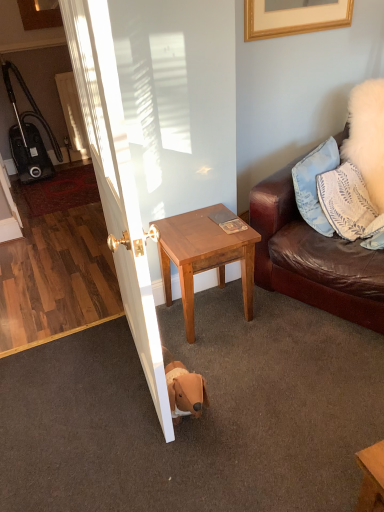
Where is `empty space that is ontop of light brown wood side table at center`? The image size is (384, 512). empty space that is ontop of light brown wood side table at center is located at coordinates (210, 227).